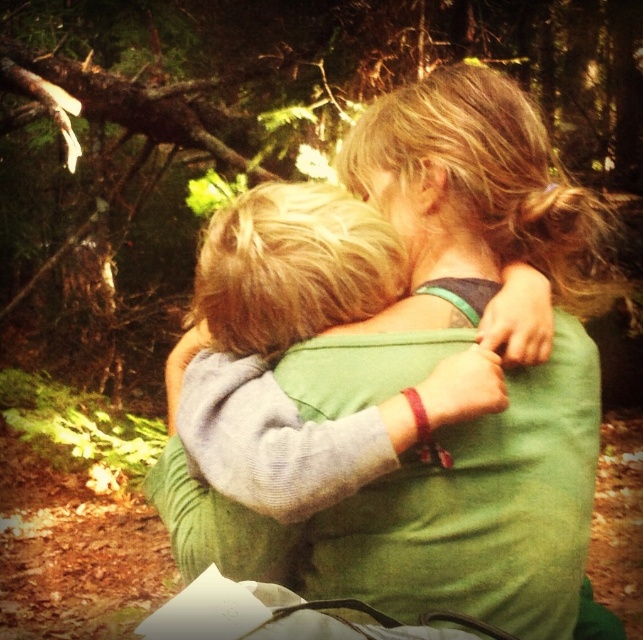
You are a photographer trying to capture the two people in the image. You notice the green soft sweater at center and the light gray fleece sweater at center. Which sweater is covering the other one?

The green soft sweater at center is positioned over the light gray fleece sweater at center, so it is covering the light gray one.

You are an artist preparing to sketch this scene. You need to decide which object to outline first based on their sizes. Which one should you start with, the green fabric at center or the light gray fleece sweater at center?

The green fabric at center is larger in size than the light gray fleece sweater at center, so you should start by outlining the green fabric at center first.